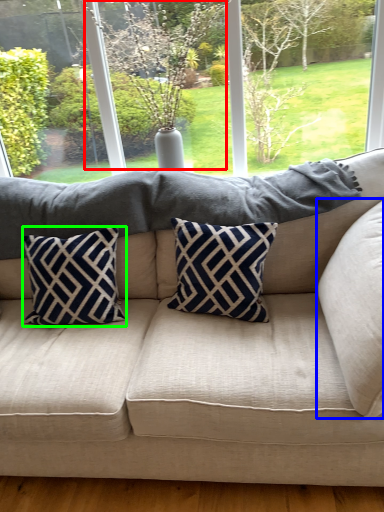
Question: Based on their relative distances, which object is nearer to tree (highlighted by a red box)? Choose from pillow (highlighted by a blue box) and pillow (highlighted by a green box).

Choices:
 (A) pillow
 (B) pillow

Answer: (B)